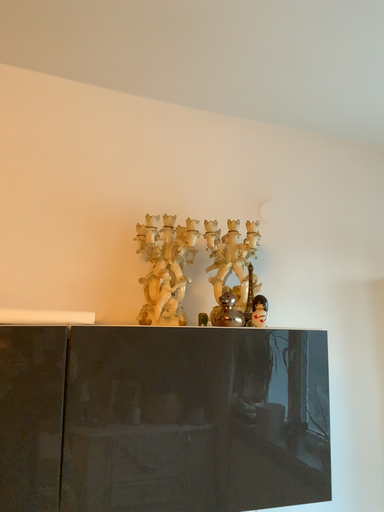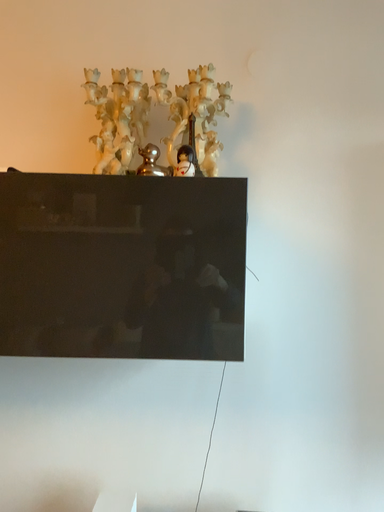
Question: Which way did the camera rotate in the video?

Choices:
 (A) rotated right
 (B) rotated left

Answer: (B)